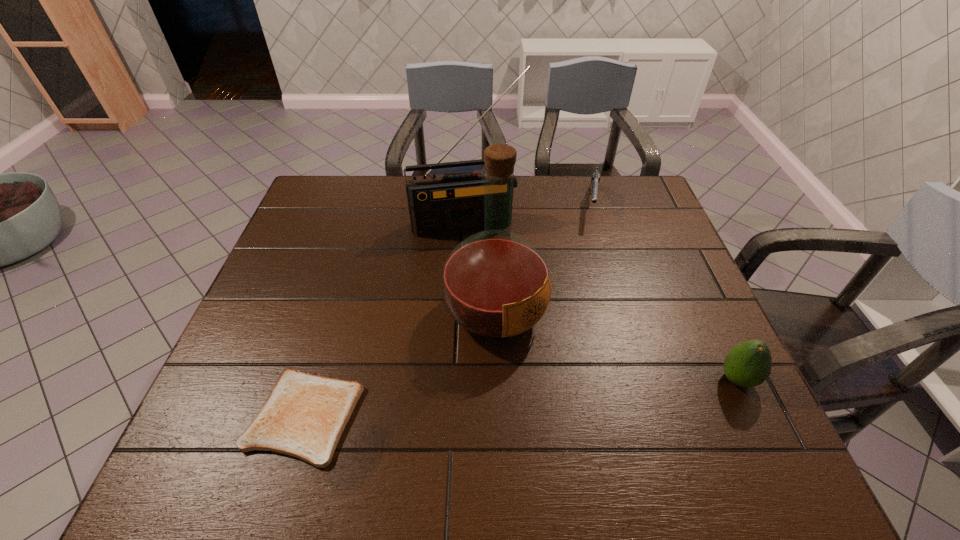
Where is `vacant space at the right edge of the desktop`? The width and height of the screenshot is (960, 540). vacant space at the right edge of the desktop is located at coordinates (681, 305).

Locate an element on the screen. vacant space at the far left corner of the desktop is located at coordinates (345, 177).

You are a GUI agent. You are given a task and a screenshot of the screen. Output one action in this format:
    pyautogui.click(x=<x>, y=<y>)
    Task: Click on the vacant space at the far right corner of the desktop
    
    Given the screenshot: What is the action you would take?
    pyautogui.click(x=643, y=208)

Find the location of a particular element. Image resolution: width=960 pixels, height=540 pixels. vacant space that's between the radio receiver and the third shortest object is located at coordinates (601, 301).

At what (x,y) coordinates should I click in order to perform the action: click on free space between the rightmost object and the leftmost object. Please return your answer as a coordinate pair (x, y). The height and width of the screenshot is (540, 960). Looking at the image, I should click on (520, 397).

Locate an element on the screen. The height and width of the screenshot is (540, 960). unoccupied area between the rightmost object and the radio receiver is located at coordinates (601, 301).

At what (x,y) coordinates should I click in order to perform the action: click on free space between the fourth object from left to right and the third shortest object. Please return your answer as a coordinate pair (x, y). The width and height of the screenshot is (960, 540). Looking at the image, I should click on (664, 292).

Locate an element on the screen. Image resolution: width=960 pixels, height=540 pixels. unoccupied area between the radio receiver and the shortest object is located at coordinates (385, 320).

Locate an element on the screen. Image resolution: width=960 pixels, height=540 pixels. free area in between the rightmost object and the radio receiver is located at coordinates (601, 301).

Locate which object is the third closest to the liquor. Please provide its 2D coordinates. Your answer should be formatted as a tuple, i.e. [(x, y)], where the tuple contains the x and y coordinates of a point satisfying the conditions above.

[(595, 179)]